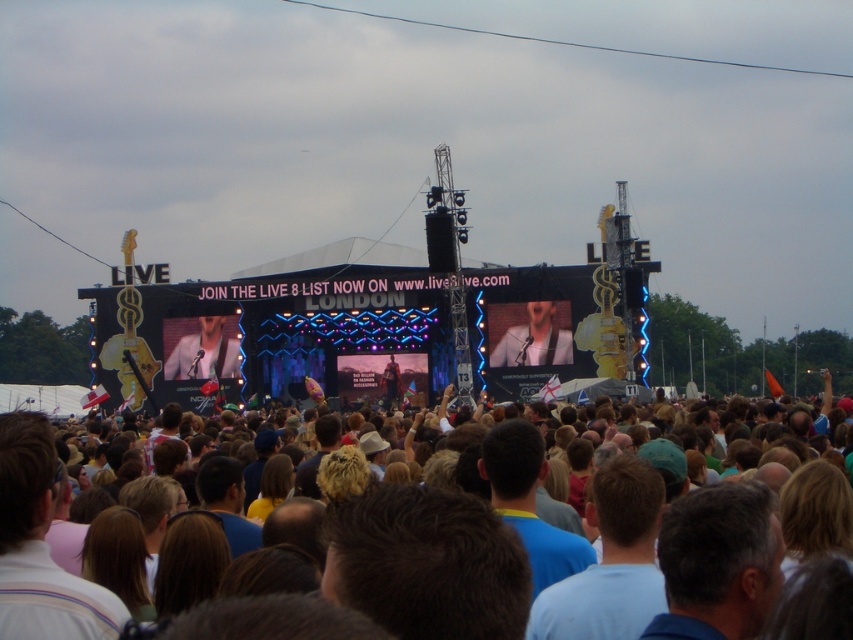
You are a photographer at the concert and want to capture a closeup of the brown hair at center. Your camera has a focal length of 50mm. If the subject is 10 meters away, what is the required sensor size in millimeters to perfectly frame the hair?

The question cannot be answered with the provided information because the 2D location coordinates do not provide sufficient data about the physical dimensions or distance needed for sensor size calculation.

You are a photographer at the concert and want to capture the brown hair at center in your shot. What are the exact coordinates where you should focus your camera?

The exact coordinates to focus on are point (648, 531).

You are a photographer standing at the camera position. You want to take a closeup shot of the brown hair at center. Given that your camera has a maximum zoom range of 400 feet, will you be able to capture a clear closeup without moving closer?

The distance between the brown hair at center and the camera is 497.59 feet, which exceeds the camera maximum zoom range of 400 feet. Therefore, you cannot capture a clear closeup without moving closer.